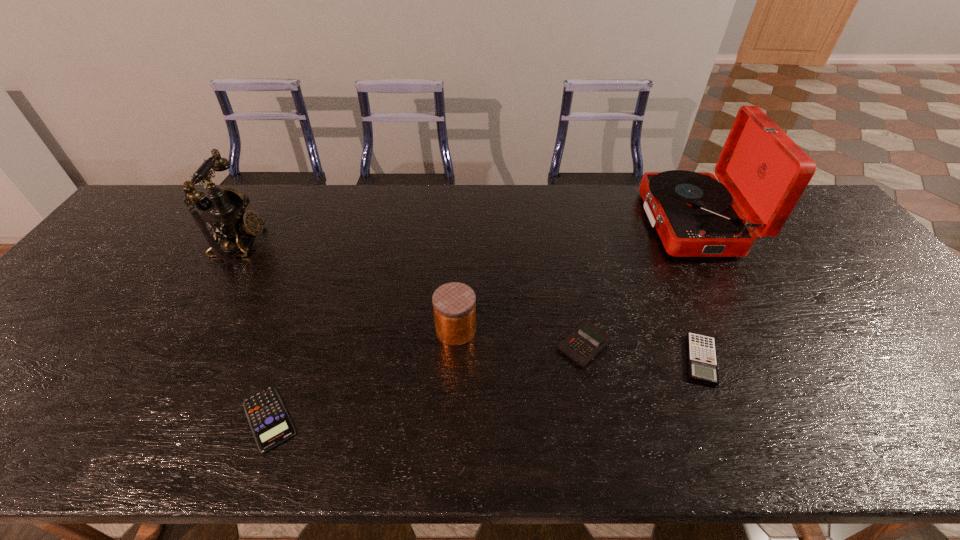
The height and width of the screenshot is (540, 960). In order to click on the leftmost calculator in this screenshot , I will do click(270, 423).

This screenshot has height=540, width=960. I want to click on free space located 0.300m on the front-facing side of the tallest object, so click(551, 222).

Locate an element on the screen. This screenshot has width=960, height=540. free spot located on the front-facing side of the tallest object is located at coordinates (586, 222).

Where is `free spot located on the front-facing side of the tallest object`? free spot located on the front-facing side of the tallest object is located at coordinates (605, 222).

At what (x,y) coordinates should I click in order to perform the action: click on vacant position located on the rotary dial of the leftmost object. Please return your answer as a coordinate pair (x, y). Looking at the image, I should click on (299, 243).

Locate an element on the screen. This screenshot has width=960, height=540. free space located on the front of the third tallest object is located at coordinates (454, 375).

At what (x,y) coordinates should I click in order to perform the action: click on vacant space located 0.060m on the front of the third shortest object. Please return your answer as a coordinate pair (x, y). Looking at the image, I should click on (592, 392).

Locate an element on the screen. The height and width of the screenshot is (540, 960). free space located 0.260m on the back of the fifth tallest object is located at coordinates (660, 262).

Find the location of a particular element. vacant area situated 0.310m on the back of the second object from left to right is located at coordinates click(x=317, y=286).

Locate an element on the screen. This screenshot has width=960, height=540. phonograph_record positioned at the far edge is located at coordinates (760, 168).